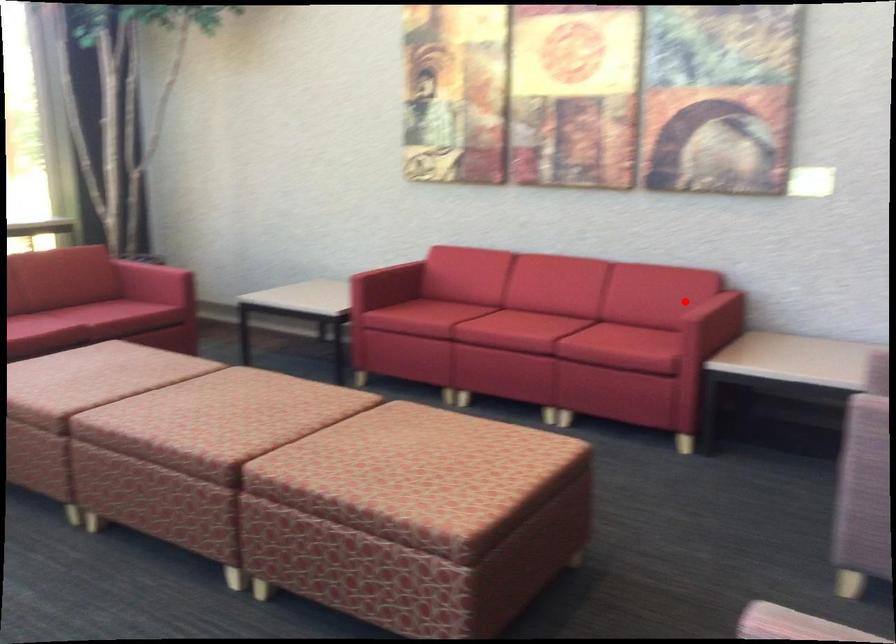
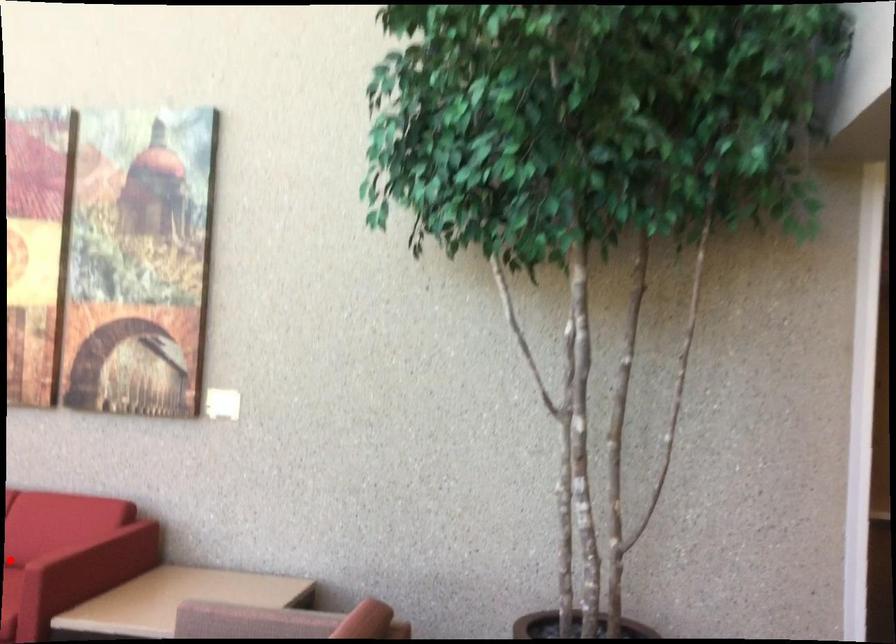
I am providing you with two images of the same scene from different viewpoints. A red point is marked on the first image and another point is marked on the second image. Is the marked point in image1 the same physical position as the marked point in image2?

No